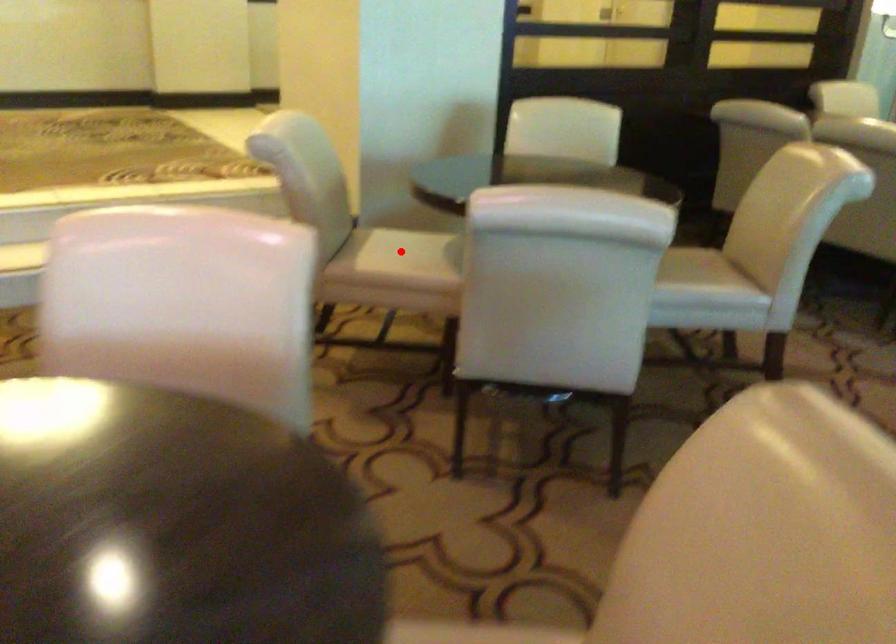
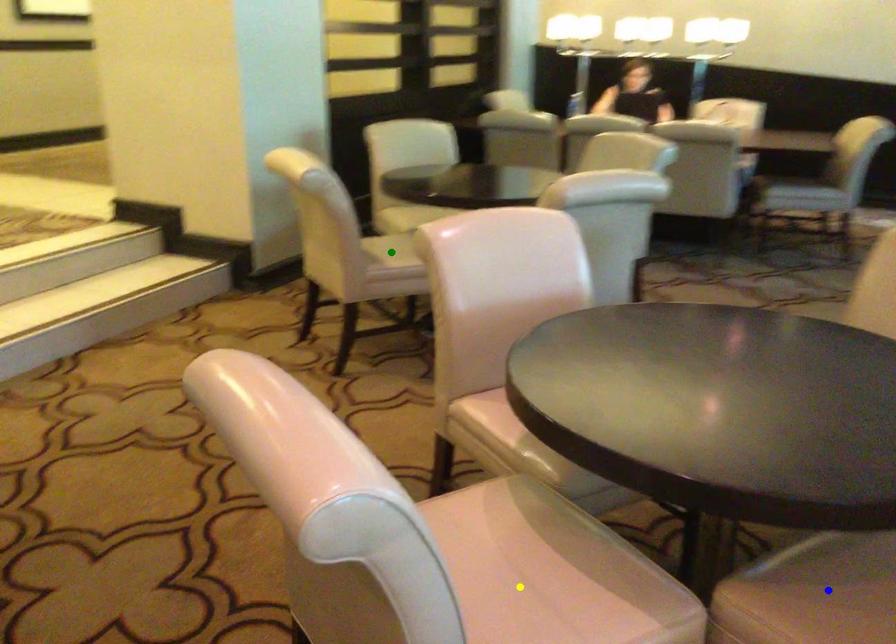
Question: I am providing you with two images of the same scene from different viewpoints. A red point is marked on the first image. You are given multiple points on the second image. Which spot in image 2 lines up with the point in image 1?

Choices:
 (A) green point
 (B) yellow point
 (C) blue point

Answer: (A)